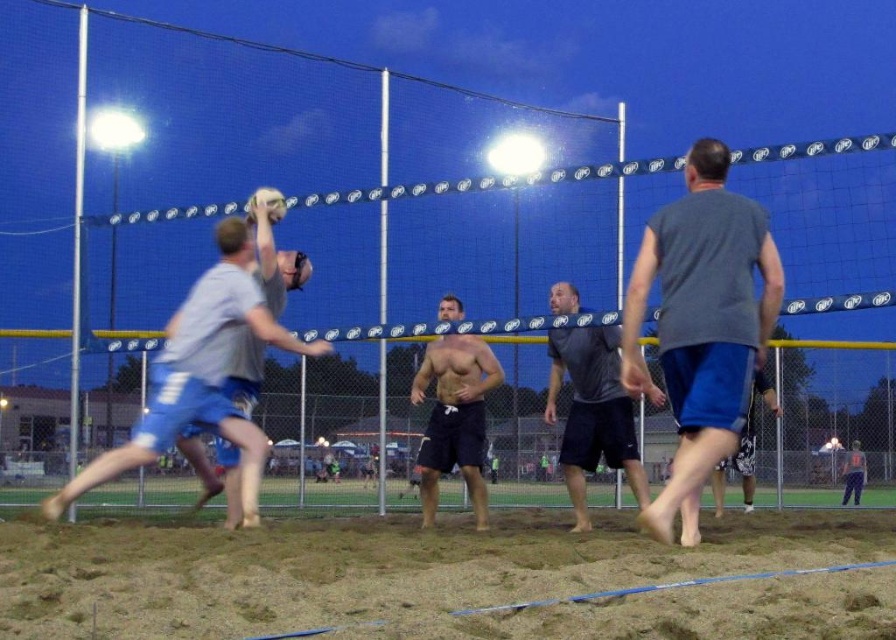
You are a photographer trying to capture the volleyball game. You want to focus on the player closest to the camera. Which of the two points, point (205, 333) or point (274, 198), should you aim your camera at?

Point (205, 333) is closer to the camera than point (274, 198), so you should aim your camera at point (205, 333) to focus on the player closest to the camera.

You are a photographer standing on the volleyball court. You want to take a photo of the dark blue shorts at lower right and the white matte volleyball at upper center. Which object should you focus on first if you want to capture both in the same frame without adjusting your camera settings?

The dark blue shorts at lower right is much taller than the white matte volleyball at upper center, so you should focus on the dark blue shorts at lower right first to ensure both are in focus.